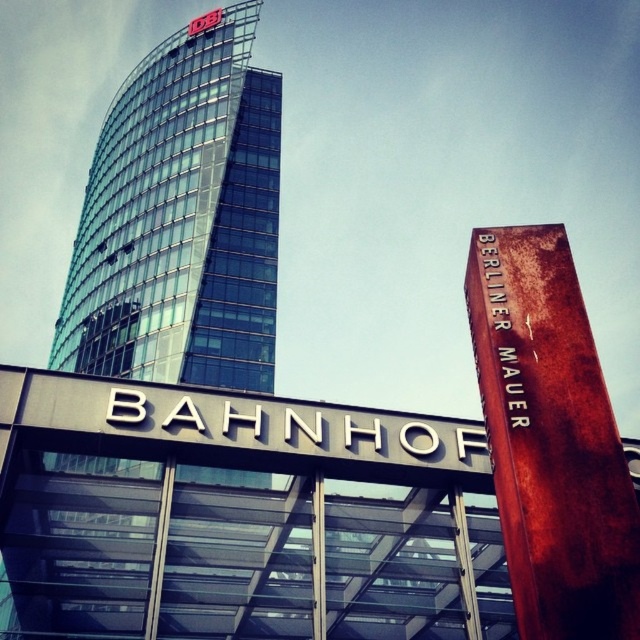
You are a tourist in Berlin and see the glassy steel skyscraper at upper left and the rusty metal berliner mauer at right. Which one is located to the left of the other?

The glassy steel skyscraper at upper left is located to the left of the rusty metal berliner mauer at right.

You are a tourist standing at the entrance of the station and want to take a photo that includes both the glassy steel skyscraper at upper left and the rusty metal berliner mauer at right. Which object should you focus on first to ensure both are in the frame?

The glassy steel skyscraper at upper left is larger than the rusty metal berliner mauer at right, so focusing on the larger skyscraper first will help ensure both objects are included in the photo frame.